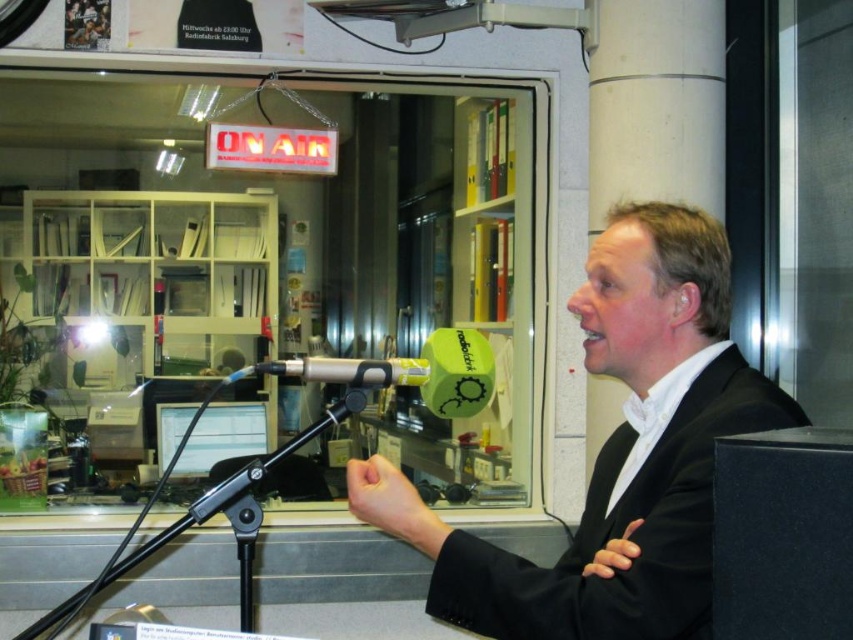
Question: Is matte black suit at center smaller than metallic silver microphone at center?

Choices:
 (A) yes
 (B) no

Answer: (B)

Question: Considering the relative positions of matte black suit at center and metallic silver microphone at center in the image provided, where is matte black suit at center located with respect to metallic silver microphone at center?

Choices:
 (A) right
 (B) left

Answer: (A)

Question: Among these objects, which one is farthest from the camera?

Choices:
 (A) matte black suit at center
 (B) metallic silver microphone at center

Answer: (B)

Question: Which point is closer to the camera?

Choices:
 (A) (688, 240)
 (B) (310, 369)

Answer: (A)

Question: Which of the following is the closest to the observer?

Choices:
 (A) metallic silver microphone at center
 (B) matte black suit at center

Answer: (B)

Question: Does matte black suit at center have a larger size compared to metallic silver microphone at center?

Choices:
 (A) no
 (B) yes

Answer: (B)